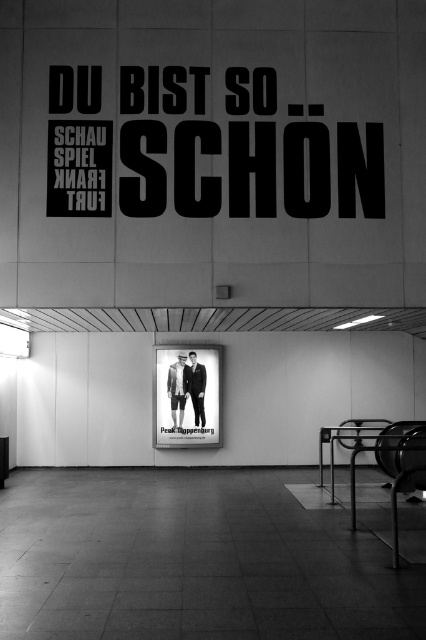
Question: Which object is farther from the camera taking this photo?

Choices:
 (A) white cotton shirt at center
 (B) dark gray suit at center

Answer: (B)

Question: Is matte black poster at center above white cotton shirt at center?

Choices:
 (A) yes
 (B) no

Answer: (B)

Question: Which point appears farthest from the camera in this image?

Choices:
 (A) (193, 368)
 (B) (180, 349)
 (C) (178, 358)

Answer: (A)

Question: Can you confirm if white cotton shirt at center is positioned above dark gray suit at center?

Choices:
 (A) yes
 (B) no

Answer: (B)

Question: Among these points, which one is nearest to the camera?

Choices:
 (A) (175, 428)
 (B) (173, 381)

Answer: (A)

Question: From the image, what is the correct spatial relationship of white cotton shirt at center in relation to dark gray suit at center?

Choices:
 (A) below
 (B) above

Answer: (A)